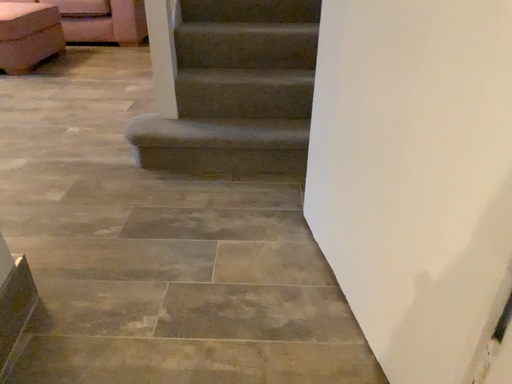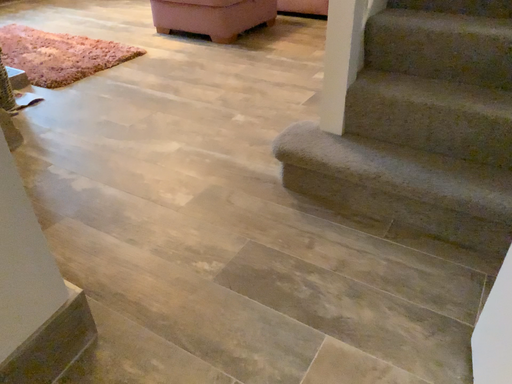
Question: Which way did the camera rotate in the video?

Choices:
 (A) rotated right
 (B) rotated left

Answer: (B)